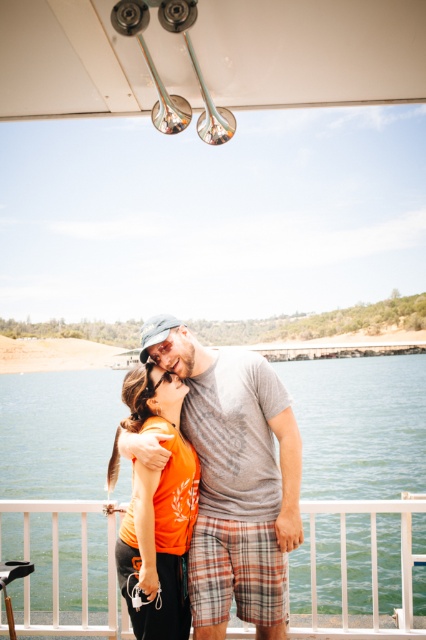
Where is `transparent water at center`? transparent water at center is located at coordinates (359, 424).

Does transparent water at center appear on the right side of gray cotton t-shirt at center?

Incorrect, transparent water at center is not on the right side of gray cotton t-shirt at center.

Does point (328, 564) come farther from viewer compared to point (210, 625)?

Yes, point (328, 564) is behind point (210, 625).

You are a GUI agent. You are given a task and a screenshot of the screen. Output one action in this format:
    pyautogui.click(x=<x>, y=<y>)
    Task: Click on the transparent water at center
    
    Given the screenshot: What is the action you would take?
    pyautogui.click(x=359, y=424)

Does gray cotton t-shirt at center have a lesser width compared to orange matte shirt at center?

No.

Does gray cotton t-shirt at center have a larger size compared to orange matte shirt at center?

Indeed, gray cotton t-shirt at center has a larger size compared to orange matte shirt at center.

Is point (270, 417) behind point (138, 499)?

Yes, point (270, 417) is behind point (138, 499).

The image size is (426, 640). Find the location of `gray cotton t-shirt at center`. gray cotton t-shirt at center is located at coordinates (235, 477).

Does transparent water at center have a greater height compared to orange matte shirt at center?

Yes, transparent water at center is taller than orange matte shirt at center.

Based on the photo, does transparent water at center have a lesser height compared to orange matte shirt at center?

No.

Measure the distance between transparent water at center and camera.

A distance of 4.89 meters exists between transparent water at center and camera.

Locate an element on the screen. This screenshot has height=640, width=426. transparent water at center is located at coordinates (359, 424).